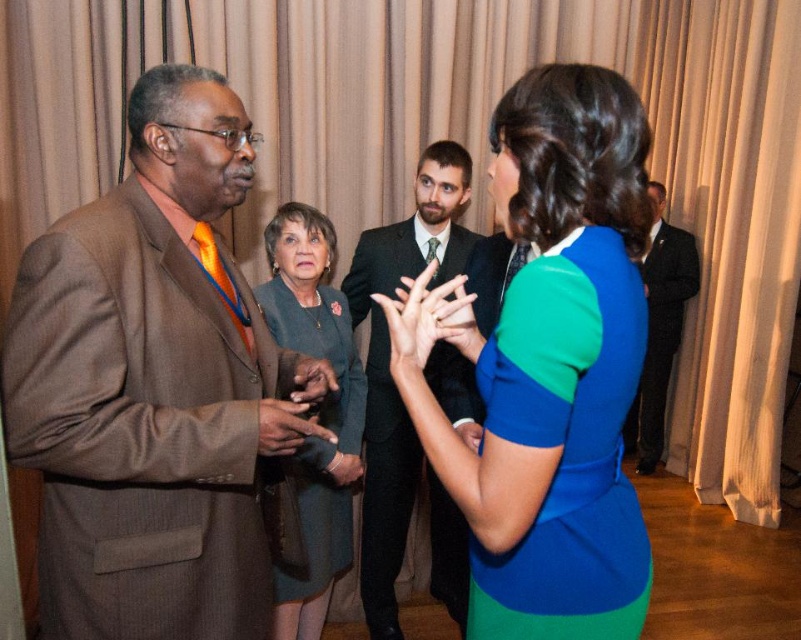
You are at a formal event and see two guests dressed in a brown pinstripe suit at left and a teal fabric dress at center. Which guest is positioned more to the left?

The teal fabric dress at center is more to the left because the brown pinstripe suit at left is to the right of it.

You are a photographer at the event and want to capture a photo of both the brown pinstripe suit at left and the teal fabric dress at center in the same frame. Your camera has a maximum focus range of 28 inches. Can you fit both subjects within the frame without moving the camera?

The brown pinstripe suit at left is 28.89 inches from the teal fabric dress at center. Since the distance between them exceeds the camera maximum focus range of 28 inches, you cannot fit both subjects within the frame without moving the camera.